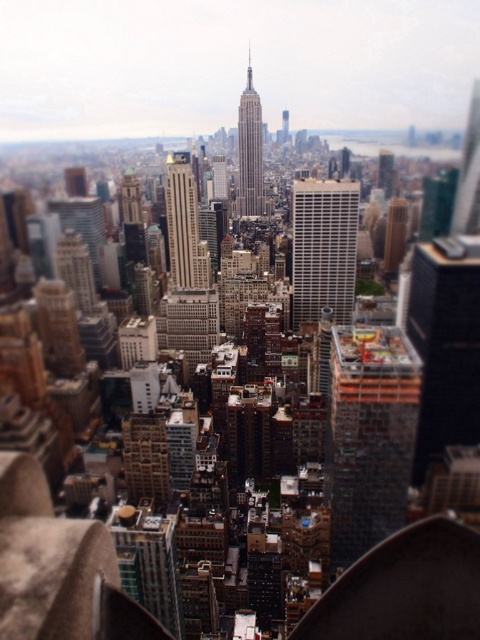
You are an urban planner analyzing the city layout. You observe the dark gray concrete construction at center and the white glass building at center. Which of these two structures has a greater width?

The dark gray concrete construction at center has a greater width than the white glass building at center according to the description.

You are a city planner reviewing the cityscape image. You need to determine which structure occupies more horizontal space in the foreground. Which one is wider between the dark gray concrete construction at center and the gray stone tower at center?

The dark gray concrete construction at center might be wider than the gray stone tower at center according to the description provided.